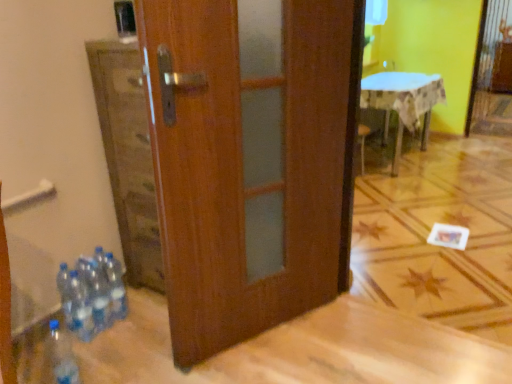
Question: Is clear plastic bottles at lower left, positioned as the 3th bottle in front-to-back order, shorter than clear plastic bottle at lower left, which ranks as the 4th bottle in back-to-front order?

Choices:
 (A) no
 (B) yes

Answer: (A)

Question: Is clear plastic bottles at lower left, which appears as the second bottle when viewed from the back, directly adjacent to clear plastic bottle at lower left, the 1th bottle viewed from the front?

Choices:
 (A) no
 (B) yes

Answer: (A)

Question: From the image's perspective, does clear plastic bottles at lower left, positioned as the 3th bottle in front-to-back order, appear higher than clear plastic bottle at lower left, the 1th bottle viewed from the front?

Choices:
 (A) yes
 (B) no

Answer: (A)

Question: Is clear plastic bottles at lower left, which appears as the second bottle when viewed from the back, wider than clear plastic bottle at lower left, the 1th bottle viewed from the front?

Choices:
 (A) yes
 (B) no

Answer: (B)

Question: From the image's perspective, is clear plastic bottles at lower left, which appears as the second bottle when viewed from the back, beneath clear plastic bottle at lower left, which ranks as the 4th bottle in back-to-front order?

Choices:
 (A) no
 (B) yes

Answer: (A)

Question: Can we say clear plastic bottles at lower left, positioned as the 3th bottle in front-to-back order, lies outside clear plastic bottle at lower left, the 1th bottle viewed from the front?

Choices:
 (A) no
 (B) yes

Answer: (B)

Question: Is white cloth-covered table at upper right taller than clear plastic bottles at lower left, positioned as the 3th bottle in front-to-back order?

Choices:
 (A) yes
 (B) no

Answer: (A)

Question: Is white cloth-covered table at upper right placed right next to clear plastic bottles at lower left, which appears as the second bottle when viewed from the back?

Choices:
 (A) yes
 (B) no

Answer: (B)

Question: Considering the relative sizes of white cloth-covered table at upper right and clear plastic bottles at lower left, which appears as the second bottle when viewed from the back, in the image provided, is white cloth-covered table at upper right thinner than clear plastic bottles at lower left, which appears as the second bottle when viewed from the back,?

Choices:
 (A) no
 (B) yes

Answer: (A)

Question: From the image's perspective, is white cloth-covered table at upper right beneath clear plastic bottles at lower left, which appears as the second bottle when viewed from the back?

Choices:
 (A) no
 (B) yes

Answer: (A)

Question: Can you confirm if white cloth-covered table at upper right is wider than clear plastic bottles at lower left, positioned as the 3th bottle in front-to-back order?

Choices:
 (A) no
 (B) yes

Answer: (B)

Question: From a real-world perspective, is white cloth-covered table at upper right physically below clear plastic bottles at lower left, positioned as the 3th bottle in front-to-back order?

Choices:
 (A) no
 (B) yes

Answer: (A)

Question: Is clear plastic bottle at lower left, which ranks as the 4th bottle in back-to-front order, at the back of clear plastic bottles at lower left, which appears as the second bottle when viewed from the front?

Choices:
 (A) yes
 (B) no

Answer: (B)